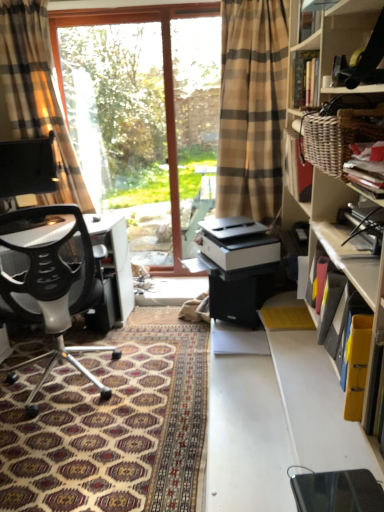
Image resolution: width=384 pixels, height=512 pixels. In order to click on free space on the front side of black mesh office chair at left in this screenshot , I will do `click(51, 449)`.